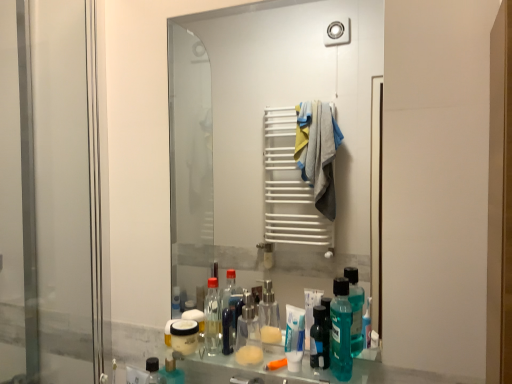
This screenshot has height=384, width=512. What do you see at coordinates (248, 334) in the screenshot?
I see `transparent plastic mouthwash at center` at bounding box center [248, 334].

Identify the location of transparent glass screen door at left. (50, 195).

What is the approximate width of clear glass mirror at center?

1.56 centimeters.

What do you see at coordinates (268, 147) in the screenshot?
I see `clear glass mirror at center` at bounding box center [268, 147].

At what (x,y) coordinates should I click in order to perform the action: click on teal plastic mouthwash at lower center. Please return your answer as a coordinate pair (x, y). The image size is (512, 384). Looking at the image, I should click on (341, 331).

Does teal plastic mouthwash at lower center turn towards transparent glass screen door at left?

No, teal plastic mouthwash at lower center does not turn towards transparent glass screen door at left.

Considering the sizes of teal plastic mouthwash at lower center and transparent glass screen door at left in the image, is teal plastic mouthwash at lower center wider or thinner than transparent glass screen door at left?

In the image, teal plastic mouthwash at lower center appears to be wider than transparent glass screen door at left.

Looking at the image, does teal plastic mouthwash at lower center seem bigger or smaller compared to transparent glass screen door at left?

In the image, teal plastic mouthwash at lower center appears to be smaller than transparent glass screen door at left.

The height and width of the screenshot is (384, 512). In order to click on screen door above the teal plastic mouthwash at lower center (from a real-world perspective) in this screenshot , I will do `click(50, 195)`.

Visually, is transparent plastic mouthwash at center positioned to the left or to the right of clear glass mirror at center?

Clearly, transparent plastic mouthwash at center is on the left of clear glass mirror at center in the image.

Which is nearer, (240, 359) or (243, 210)?

The point (240, 359) is in front.

Is transparent plastic mouthwash at center taller or shorter than clear glass mirror at center?

In the image, transparent plastic mouthwash at center appears to be shorter than clear glass mirror at center.

You are a GUI agent. You are given a task and a screenshot of the screen. Output one action in this format:
    pyautogui.click(x=<x>, y=<y>)
    Task: Click on the mirror above the transparent plastic mouthwash at center (from a real-world perspective)
    The width and height of the screenshot is (512, 384).
    Given the screenshot: What is the action you would take?
    pyautogui.click(x=268, y=147)

How different are the orientations of transparent glass screen door at left and clear glass mirror at center in degrees?

The angular difference between transparent glass screen door at left and clear glass mirror at center is 90 degrees.

Is transparent glass screen door at left situated inside clear glass mirror at center or outside?

transparent glass screen door at left exists outside the volume of clear glass mirror at center.

Is transparent glass screen door at left wider than clear glass mirror at center?

Indeed, transparent glass screen door at left has a greater width compared to clear glass mirror at center.

Between transparent glass screen door at left and clear glass mirror at center, which one appears on the right side from the viewer's perspective?

clear glass mirror at center is more to the right.

Considering the sizes of objects clear glass mirror at center and transparent plastic mouthwash at center in the image provided, who is wider, clear glass mirror at center or transparent plastic mouthwash at center?

transparent plastic mouthwash at center.

Looking at this image, based on their positions, is clear glass mirror at center located to the left or right of transparent plastic mouthwash at center?

Based on their positions, clear glass mirror at center is located to the right of transparent plastic mouthwash at center.

Is clear glass mirror at center oriented towards transparent plastic mouthwash at center?

Yes.

Is transparent plastic mouthwash at center completely or partially inside clear glass mirror at center?

That's incorrect, transparent plastic mouthwash at center is not inside clear glass mirror at center.

Image resolution: width=512 pixels, height=384 pixels. What are the coordinates of `screen door that appears above the transparent plastic mouthwash at center (from the image's perspective)` in the screenshot? It's located at (50, 195).

Considering the sizes of objects transparent plastic mouthwash at center and transparent glass screen door at left in the image provided, who is taller, transparent plastic mouthwash at center or transparent glass screen door at left?

Standing taller between the two is transparent glass screen door at left.

Considering the points (250, 364) and (72, 86), which point is in front, point (250, 364) or point (72, 86)?

Point (250, 364)

Is transparent plastic mouthwash at center positioned far away from transparent glass screen door at left?

No, transparent plastic mouthwash at center is not far from transparent glass screen door at left.

Considering the sizes of transparent plastic mouthwash at center and teal plastic mouthwash at lower center in the image, is transparent plastic mouthwash at center taller or shorter than teal plastic mouthwash at lower center?

transparent plastic mouthwash at center is shorter than teal plastic mouthwash at lower center.

From the image's perspective, is transparent plastic mouthwash at center over teal plastic mouthwash at lower center?

No, from the image's perspective, transparent plastic mouthwash at center is not above teal plastic mouthwash at lower center.

Can you confirm if transparent plastic mouthwash at center is bigger than teal plastic mouthwash at lower center?

Correct, transparent plastic mouthwash at center is larger in size than teal plastic mouthwash at lower center.

Which is less distant, (249, 299) or (337, 292)?

The point (337, 292) is more forward.

Can you confirm if transparent glass screen door at left is shorter than transparent plastic mouthwash at center?

No, transparent glass screen door at left is not shorter than transparent plastic mouthwash at center.

Is transparent glass screen door at left facing away from transparent plastic mouthwash at center?

That's not correct — transparent glass screen door at left is not looking away from transparent plastic mouthwash at center.

Is transparent glass screen door at left far away from transparent plastic mouthwash at center?

No, transparent glass screen door at left is not far away from transparent plastic mouthwash at center.

Considering the relative positions of transparent glass screen door at left and transparent plastic mouthwash at center in the image provided, is transparent glass screen door at left to the right of transparent plastic mouthwash at center from the viewer's perspective?

In fact, transparent glass screen door at left is to the left of transparent plastic mouthwash at center.

You are a GUI agent. You are given a task and a screenshot of the screen. Output one action in this format:
    pyautogui.click(x=<x>, y=<y>)
    Task: Click on the cleaning product lying on the right of transparent glass screen door at left
    Image resolution: width=512 pixels, height=384 pixels.
    Given the screenshot: What is the action you would take?
    pyautogui.click(x=341, y=331)

You are a GUI agent. You are given a task and a screenshot of the screen. Output one action in this format:
    pyautogui.click(x=<x>, y=<y>)
    Task: Click on the mirror above the transparent plastic mouthwash at center (from a real-world perspective)
    The width and height of the screenshot is (512, 384).
    Given the screenshot: What is the action you would take?
    pyautogui.click(x=268, y=147)

Which object lies further to the anchor point clear glass mirror at center, transparent glass screen door at left or transparent plastic mouthwash at center?

transparent plastic mouthwash at center.

Looking at the image, which one is located closer to teal plastic mouthwash at lower center, transparent plastic mouthwash at center or transparent glass screen door at left?

transparent plastic mouthwash at center is closer to teal plastic mouthwash at lower center.

From the image, which object appears to be nearer to teal plastic mouthwash at lower center, clear glass mirror at center or transparent glass screen door at left?

Based on the image, transparent glass screen door at left appears to be nearer to teal plastic mouthwash at lower center.

Looking at this image, based on their spatial positions, is transparent plastic mouthwash at center or clear glass mirror at center further from teal plastic mouthwash at lower center?

The object further to teal plastic mouthwash at lower center is clear glass mirror at center.

Based on their spatial positions, is clear glass mirror at center or transparent glass screen door at left further from transparent plastic mouthwash at center?

Among the two, clear glass mirror at center is located further to transparent plastic mouthwash at center.

When comparing their distances from transparent glass screen door at left, does transparent plastic mouthwash at center or teal plastic mouthwash at lower center seem further?

Among the two, teal plastic mouthwash at lower center is located further to transparent glass screen door at left.

Which object lies further to the anchor point transparent plastic mouthwash at center, teal plastic mouthwash at lower center or transparent glass screen door at left?

transparent glass screen door at left is further to transparent plastic mouthwash at center.

From the image, which object appears to be nearer to clear glass mirror at center, transparent plastic mouthwash at center or teal plastic mouthwash at lower center?

Based on the image, transparent plastic mouthwash at center appears to be nearer to clear glass mirror at center.

Where is `mouthwash situated between transparent glass screen door at left and clear glass mirror at center from left to right`? Image resolution: width=512 pixels, height=384 pixels. mouthwash situated between transparent glass screen door at left and clear glass mirror at center from left to right is located at coordinates (248, 334).

At what (x,y) coordinates should I click in order to perform the action: click on cleaning product between clear glass mirror at center and transparent plastic mouthwash at center in the vertical direction. Please return your answer as a coordinate pair (x, y). Image resolution: width=512 pixels, height=384 pixels. Looking at the image, I should click on (341, 331).

Locate an element on the screen. mirror between transparent glass screen door at left and teal plastic mouthwash at lower center in the horizontal direction is located at coordinates (268, 147).

I want to click on mouthwash between transparent glass screen door at left and teal plastic mouthwash at lower center from left to right, so click(x=248, y=334).